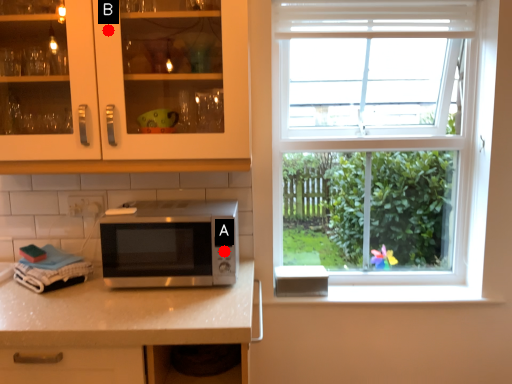
Question: Two points are circled on the image, labeled by A and B beside each circle. Which point is farther from the camera taking this photo?

Choices:
 (A) A is further
 (B) B is further

Answer: (A)